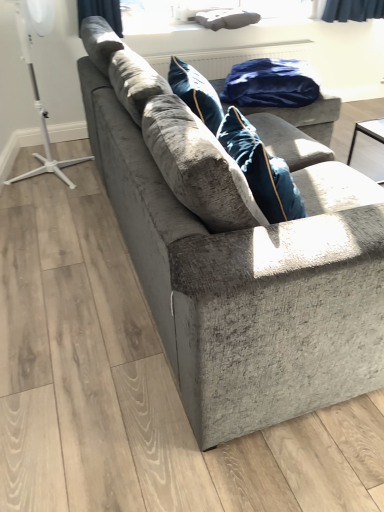
Question: Does velvet gray couch at center lie behind white plastic tripod at left?

Choices:
 (A) no
 (B) yes

Answer: (A)

Question: From the image's perspective, is velvet gray couch at center above white plastic tripod at left?

Choices:
 (A) no
 (B) yes

Answer: (A)

Question: Is velvet gray couch at center looking in the opposite direction of white plastic tripod at left?

Choices:
 (A) yes
 (B) no

Answer: (A)

Question: Is velvet gray couch at center taller than white plastic tripod at left?

Choices:
 (A) no
 (B) yes

Answer: (A)

Question: Is velvet gray couch at center positioned before white plastic tripod at left?

Choices:
 (A) yes
 (B) no

Answer: (A)

Question: Considering the positions of transparent glass window screen at upper center and blue velvet blanket at upper center in the image, is transparent glass window screen at upper center wider or thinner than blue velvet blanket at upper center?

Choices:
 (A) thin
 (B) wide

Answer: (A)

Question: From a real-world perspective, is transparent glass window screen at upper center physically located above or below blue velvet blanket at upper center?

Choices:
 (A) above
 (B) below

Answer: (A)

Question: Is transparent glass window screen at upper center taller or shorter than blue velvet blanket at upper center?

Choices:
 (A) short
 (B) tall

Answer: (B)

Question: In the image, is transparent glass window screen at upper center positioned in front of or behind blue velvet blanket at upper center?

Choices:
 (A) front
 (B) behind

Answer: (B)

Question: In terms of height, does velvet gray couch at center look taller or shorter compared to blue velvet blanket at upper center?

Choices:
 (A) tall
 (B) short

Answer: (A)

Question: In the image, is velvet gray couch at center positioned in front of or behind blue velvet blanket at upper center?

Choices:
 (A) behind
 (B) front

Answer: (B)

Question: Is velvet gray couch at center situated inside blue velvet blanket at upper center or outside?

Choices:
 (A) inside
 (B) outside

Answer: (B)

Question: Considering the positions of velvet gray couch at center and blue velvet blanket at upper center in the image, is velvet gray couch at center bigger or smaller than blue velvet blanket at upper center?

Choices:
 (A) big
 (B) small

Answer: (A)

Question: From the image's perspective, is blue velvet blanket at upper center positioned above or below transparent glass window screen at upper center?

Choices:
 (A) above
 (B) below

Answer: (B)

Question: Is blue velvet blanket at upper center inside the boundaries of transparent glass window screen at upper center, or outside?

Choices:
 (A) outside
 (B) inside

Answer: (A)